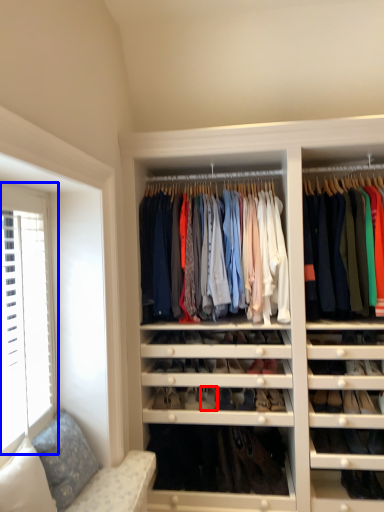
Question: Which object is closer to the camera taking this photo, shoe (highlighted by a red box) or window (highlighted by a blue box)?

Choices:
 (A) shoe
 (B) window

Answer: (B)